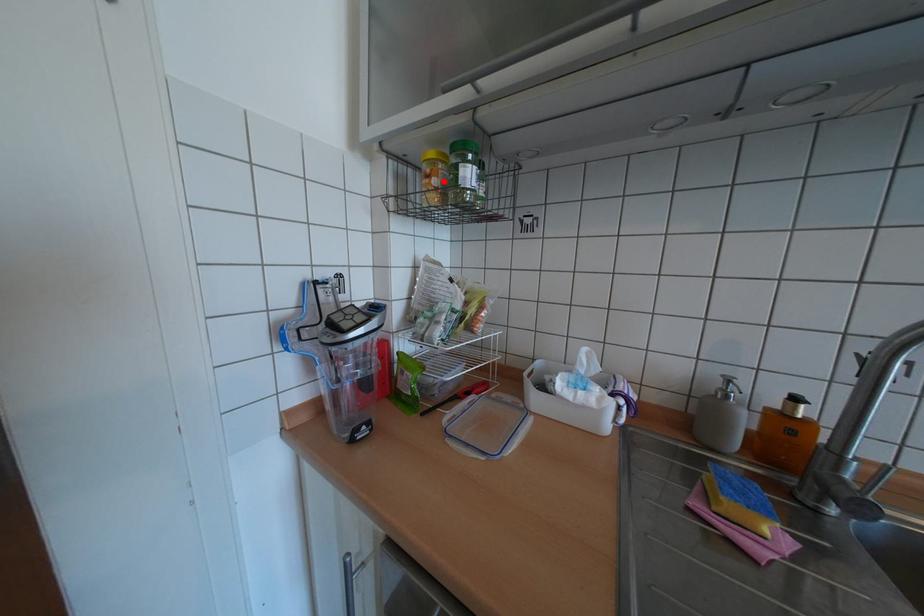
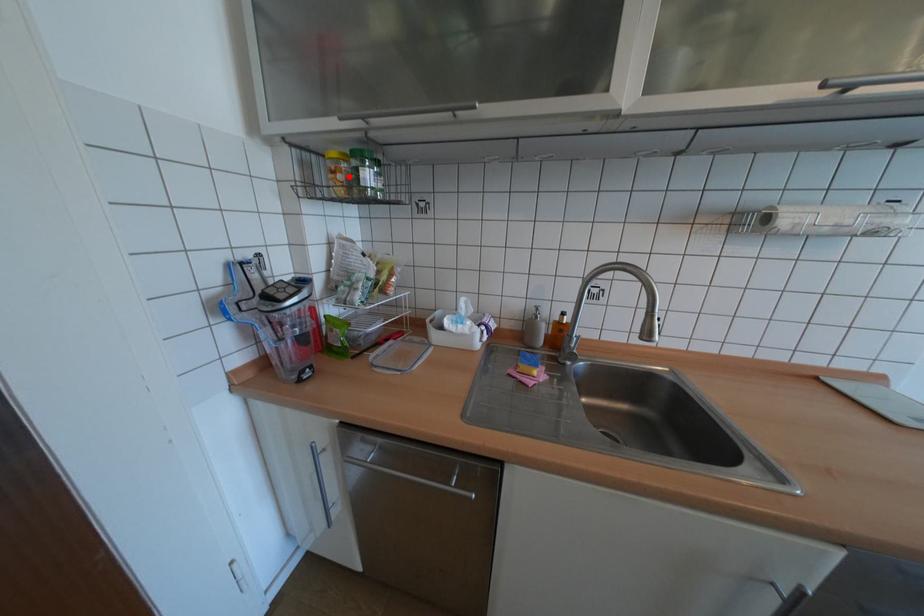
I am providing you with two images of the same scene from different viewpoints. A red point is marked on the first image and another point is marked on the second image. Are the points marked in image1 and image2 representing the same 3D position?

Yes